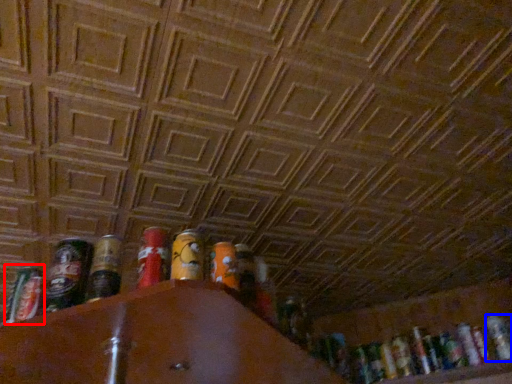
Question: Which of the following is the farthest to the observer, spray can (highlighted by a red box) or beer (highlighted by a blue box)?

Choices:
 (A) spray can
 (B) beer

Answer: (B)